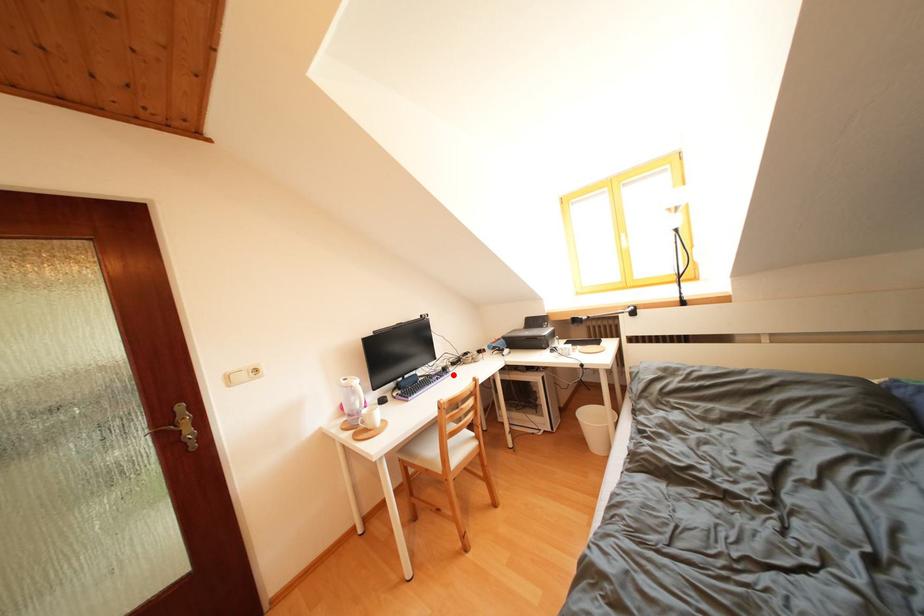
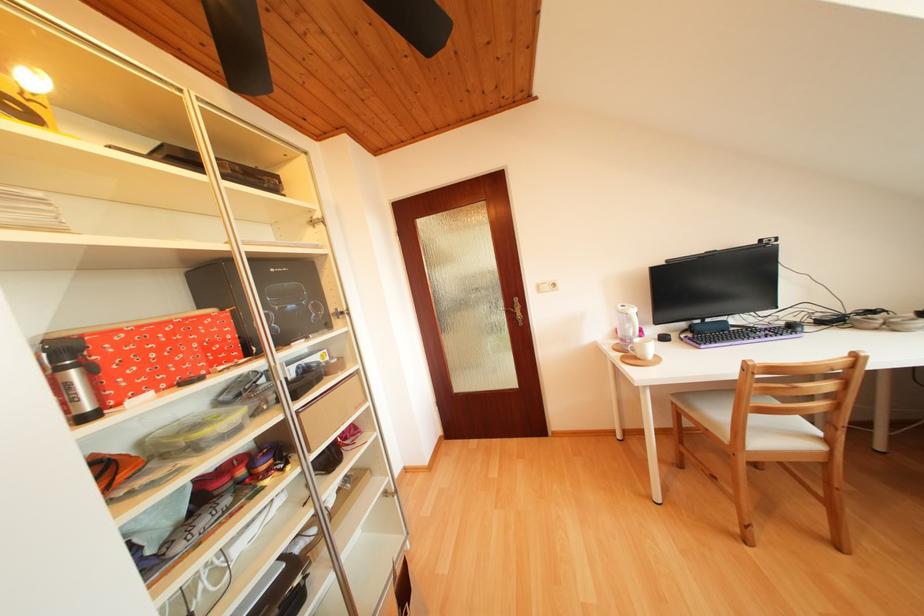
Find the pixel in the second image that matches the highlighted location in the first image.

(799, 331)